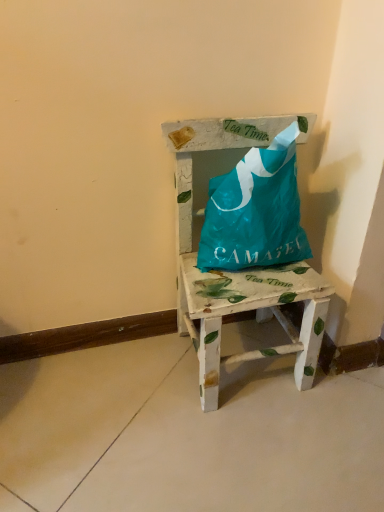
Question: In terms of width, does teal plastic bag at center look wider or thinner when compared to painted wood chair at center?

Choices:
 (A) thin
 (B) wide

Answer: (A)

Question: Is point (231, 233) closer or farther from the camera than point (258, 287)?

Choices:
 (A) farther
 (B) closer

Answer: (A)

Question: From the image's perspective, is teal plastic bag at center located above or below painted wood chair at center?

Choices:
 (A) below
 (B) above

Answer: (B)

Question: Based on their sizes in the image, would you say painted wood chair at center is bigger or smaller than teal plastic bag at center?

Choices:
 (A) big
 (B) small

Answer: (A)

Question: From a real-world perspective, relative to teal plastic bag at center, is painted wood chair at center vertically above or below?

Choices:
 (A) above
 (B) below

Answer: (B)

Question: From their relative heights in the image, would you say painted wood chair at center is taller or shorter than teal plastic bag at center?

Choices:
 (A) tall
 (B) short

Answer: (A)

Question: Considering the positions of painted wood chair at center and teal plastic bag at center in the image, is painted wood chair at center wider or thinner than teal plastic bag at center?

Choices:
 (A) wide
 (B) thin

Answer: (A)